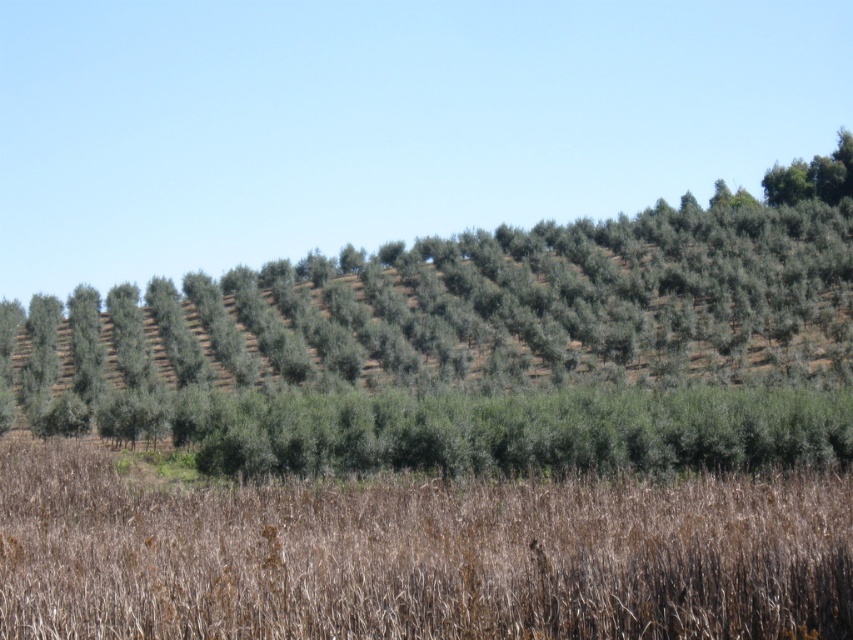
You are a farmer checking the health of your crops. You notice the green leafy trees at center and the brown dry grass at lower center. Which one is taller?

The green leafy trees at center are taller than the brown dry grass at lower center.